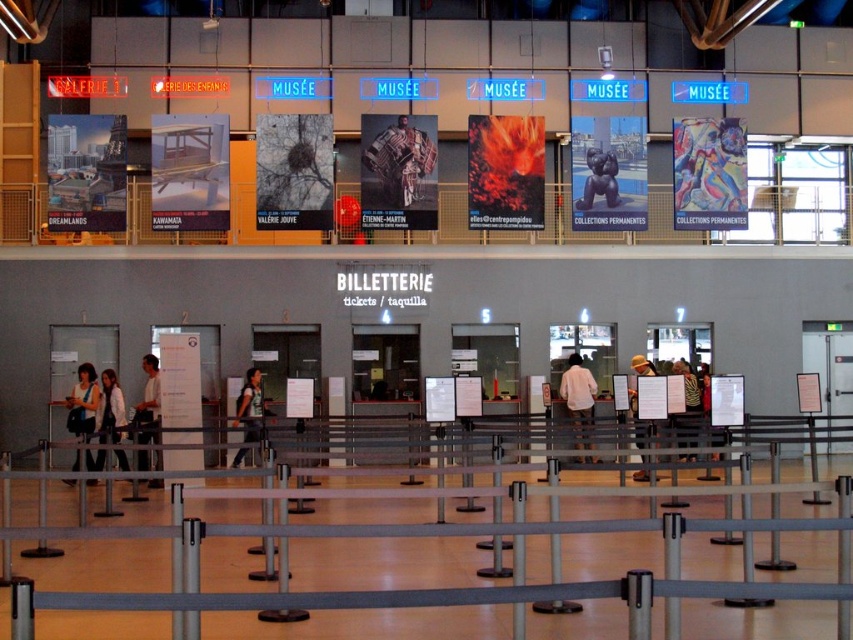
Question: Estimate the real-world distances between objects in this image. Which object is farther from the light brown leather jacket at lower left?

Choices:
 (A) matte black jacket at center
 (B) abstract painting at upper right
 (C) striped shirt at center

Answer: (B)

Question: Is gray metallic barrier at center closer to camera compared to white matte shirt at center?

Choices:
 (A) yes
 (B) no

Answer: (A)

Question: Is abstract painting at upper right below light brown leather jacket at center?

Choices:
 (A) no
 (B) yes

Answer: (A)

Question: Which of the following is the farthest from the observer?

Choices:
 (A) (144, 362)
 (B) (711, 138)
 (C) (577, 436)
 (D) (248, 432)

Answer: (B)

Question: Does gray metallic barrier at center come behind green fabric jacket at center?

Choices:
 (A) no
 (B) yes

Answer: (A)

Question: Which point is closer to the camera?

Choices:
 (A) abstract painting at upper right
 (B) light brown leather jacket at center

Answer: (B)